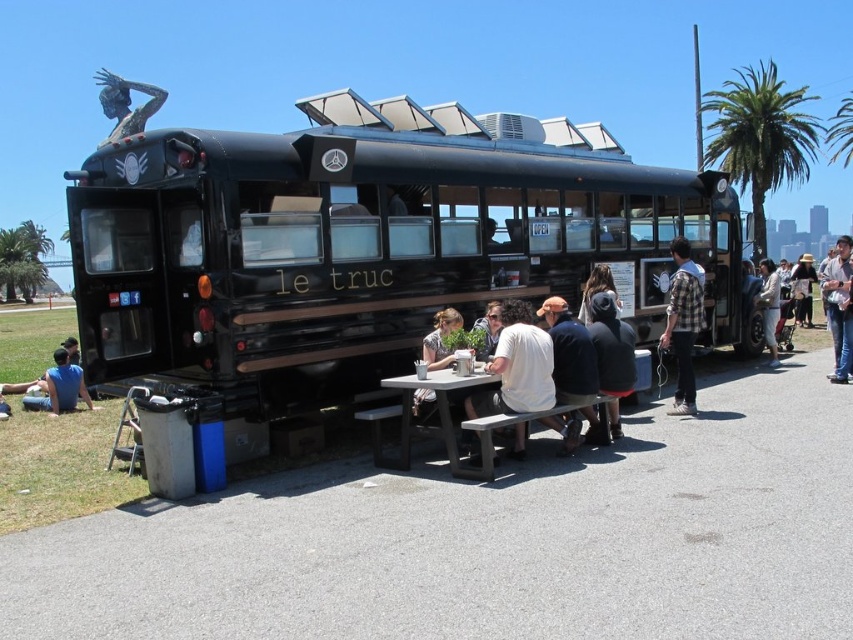
Question: Based on their relative distances, which object is nearer to the white matte shirt at center?

Choices:
 (A) matte white shirt at center
 (B) matte black hoodie at center
 (C) black plastic table at center
 (D) plaid shirt at right

Answer: (C)

Question: Which object appears closest to the camera in this image?

Choices:
 (A) white cotton shirt at center
 (B) blue cotton shirt at lower left

Answer: (A)

Question: Where is green leafy palm tree at upper right located in relation to white fabric jacket at right in the image?

Choices:
 (A) right
 (B) left

Answer: (A)

Question: Which object is positioned farthest from the white fabric jacket at right?

Choices:
 (A) green leafy palm tree at upper right
 (B) matte white shirt at center

Answer: (A)

Question: Is green leafy palm tree at upper right above black plastic table at center?

Choices:
 (A) yes
 (B) no

Answer: (A)

Question: Can you confirm if black matte bus at center is positioned above white cotton shirt at center?

Choices:
 (A) no
 (B) yes

Answer: (B)